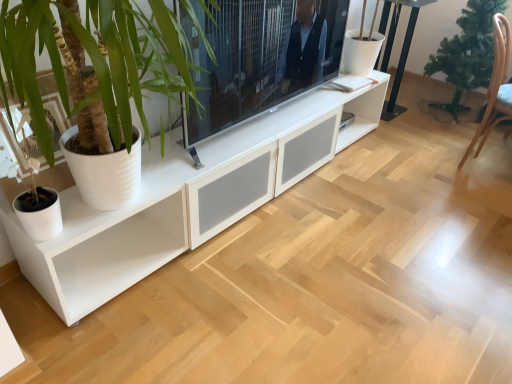
Find the location of a particular element. This screenshot has height=384, width=512. free location to the left of green matte christmas tree at right is located at coordinates (408, 120).